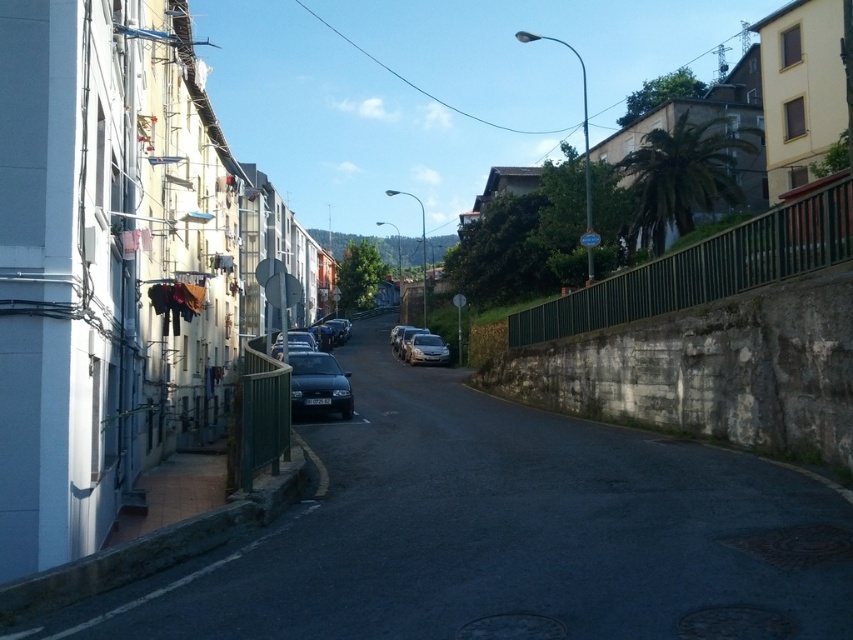
You are a delivery driver who needs to park your van, which is 2 meters wide, between the satin black car at center and the satin silver car at center. Based on the scene, can you fit your van there?

The satin black car at center is smaller than the satin silver car at center, but the distance between them isn not specified. Therefore, it is unclear if the van will fit.

You are driving a car that is 16 feet long. You need to make a U turn on the smooth asphalt road at center. Is there enough space for your car to complete the U turn without moving any objects?

The smooth asphalt road at center has a width of 16.78 feet, which is slightly wider than your car length of 16 feet. Therefore, there is just enough space to make a U turn without moving any objects.

What are the coordinates of the smooth asphalt road at center?

The smooth asphalt road at center is located at coordinates point (503, 534).